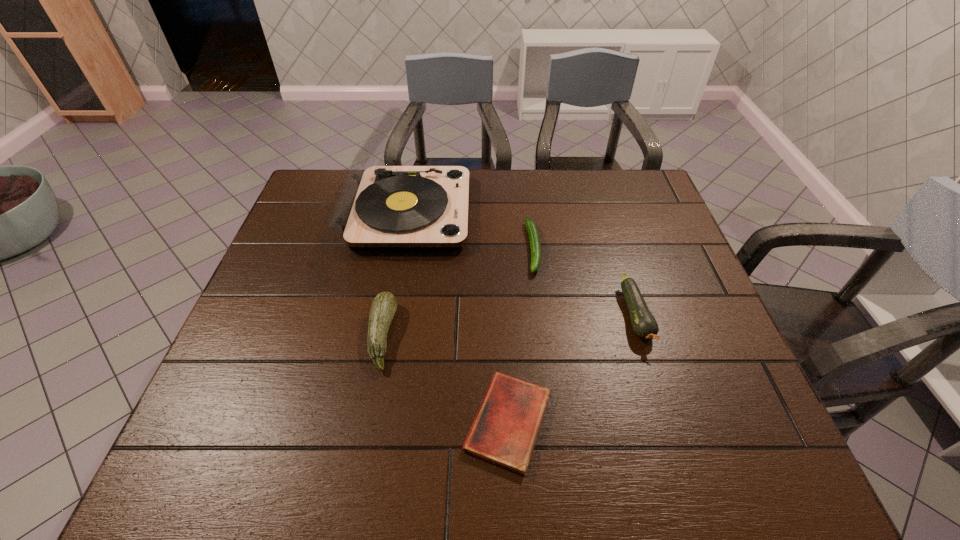
The height and width of the screenshot is (540, 960). In order to click on blank space located 0.100m on the front-facing side of the shortest zucchini in this screenshot , I will do `click(540, 306)`.

Find the location of `vacant space located on the right of the nearest object`. vacant space located on the right of the nearest object is located at coordinates (713, 422).

This screenshot has width=960, height=540. I want to click on object that is at the far edge, so click(x=380, y=207).

What are the coordinates of `object located in the near edge section of the desktop` in the screenshot? It's located at (504, 432).

Where is `object that is at the left edge`? The image size is (960, 540). object that is at the left edge is located at coordinates [380, 207].

At what (x,y) coordinates should I click in order to perform the action: click on object at the right edge. Please return your answer as a coordinate pair (x, y). Looking at the image, I should click on (644, 325).

Identify the location of object at the far left corner. (380, 207).

Where is `free space at the far edge`? Image resolution: width=960 pixels, height=540 pixels. free space at the far edge is located at coordinates (576, 173).

In the image, there is a desktop. In order to click on free space at the near edge in this screenshot , I will do `click(312, 445)`.

Identify the location of vacant space at the left edge of the desktop. (256, 335).